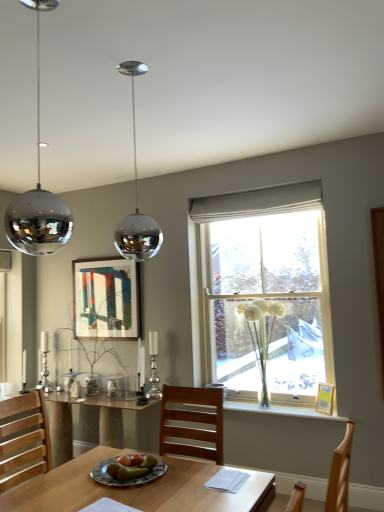
Where is `vacant space situated on the left part of wooden picture frame at window, which is counted as the 1th picture frame, starting from the right`? Image resolution: width=384 pixels, height=512 pixels. vacant space situated on the left part of wooden picture frame at window, which is counted as the 1th picture frame, starting from the right is located at coordinates (306, 414).